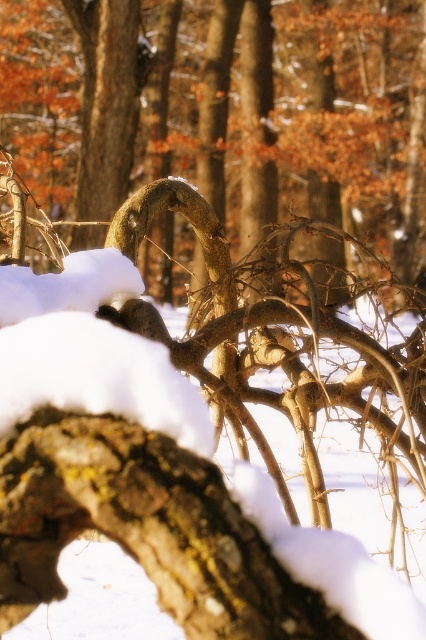
You are an artist sketching this winter forest scene. You want to draw the brown rough tree trunk at upper center and the smooth bark tree trunk at center. Which one should you draw first to make sure it appears closer to the viewer?

You should draw the smooth bark tree trunk at center first because the brown rough tree trunk at upper center is behind it, meaning the smooth bark tree trunk at center is closer and should be sketched first to appear in front.

You are an artist sketching the forest scene. You need to draw the smooth bark tree trunk at center and the brown rough tree trunk at upper center. Which tree trunk should you draw first if you want to follow the natural left to right flow of the scene?

You should draw the brown rough tree trunk at upper center first because it is positioned to the left of the smooth bark tree trunk at center, allowing you to follow the left to right flow.